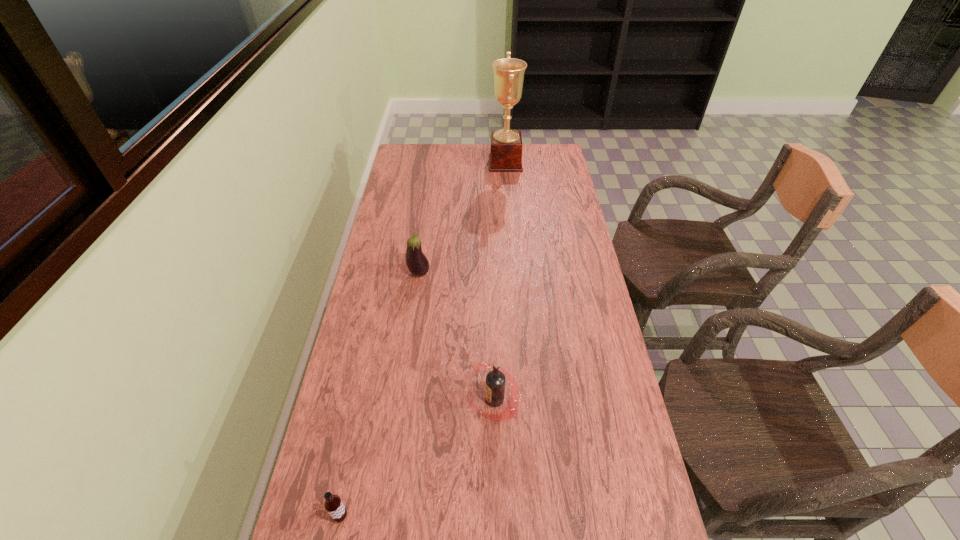
The height and width of the screenshot is (540, 960). What are the coordinates of `the tallest object` in the screenshot? It's located at (506, 146).

In order to click on the farthest object in this screenshot , I will do `click(506, 146)`.

I want to click on eggplant, so click(x=417, y=263).

Locate an element on the screen. The width and height of the screenshot is (960, 540). the third object from right to left is located at coordinates pos(417,263).

Where is `the third farthest object`? the third farthest object is located at coordinates (495, 380).

This screenshot has height=540, width=960. I want to click on the right root beer, so click(495, 380).

You are a GUI agent. You are given a task and a screenshot of the screen. Output one action in this format:
    pyautogui.click(x=<x>, y=<y>)
    Task: Click on the shortest object
    This screenshot has width=960, height=540.
    Given the screenshot: What is the action you would take?
    pyautogui.click(x=333, y=505)

This screenshot has width=960, height=540. Identify the location of the left root beer. (x=333, y=505).

The image size is (960, 540). In order to click on vacant space positioned on the plaque of the tallest object in this screenshot , I will do `click(422, 163)`.

Locate an element on the screen. This screenshot has width=960, height=540. vacant space located on the plaque of the tallest object is located at coordinates (409, 163).